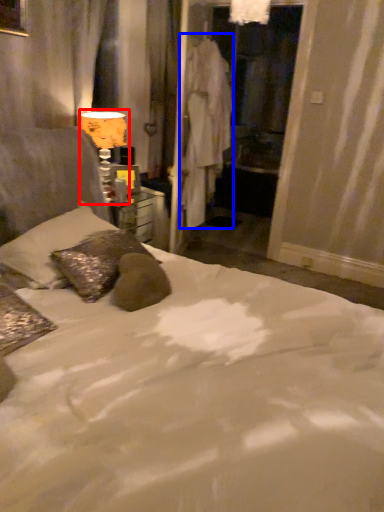
Question: Which object is closer to the camera taking this photo, table lamp (highlighted by a red box) or robe (highlighted by a blue box)?

Choices:
 (A) table lamp
 (B) robe

Answer: (A)